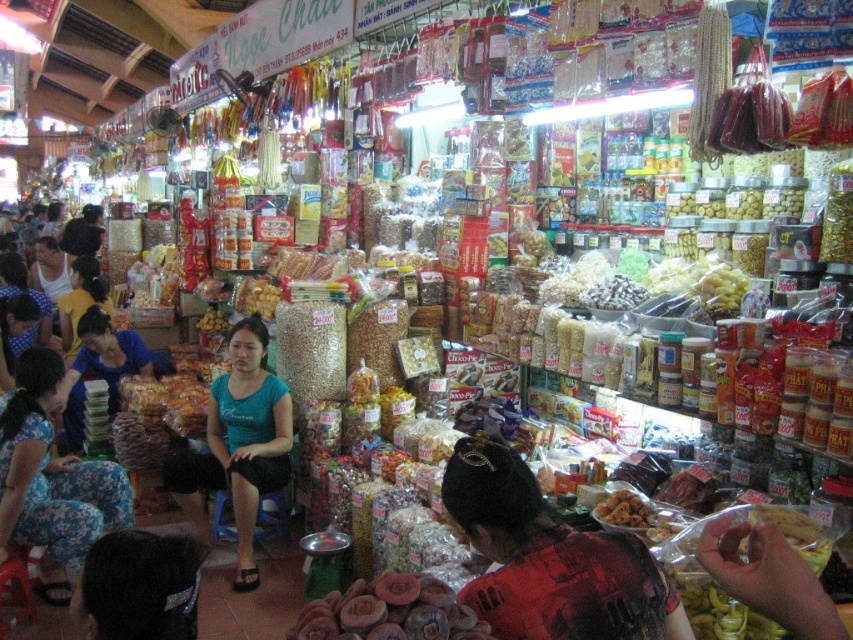
Question: Which of the following is the closest to the observer?

Choices:
 (A) blue fabric shirt at center
 (B) golden crispy snack at center
 (C) purple matte dried mushrooms at lower center
 (D) floral fabric pants at lower left

Answer: (C)

Question: Which of these objects is positioned farthest from the golden crispy snack at center?

Choices:
 (A) purple matte dried mushrooms at lower center
 (B) floral fabric pants at lower left
 (C) blue fabric shirt at center

Answer: (B)

Question: Is blue fabric shirt at center wider than golden crispy snack at center?

Choices:
 (A) no
 (B) yes

Answer: (B)

Question: Is purple matte dried mushrooms at lower center positioned behind golden crispy snack at center?

Choices:
 (A) no
 (B) yes

Answer: (A)

Question: Based on their relative distances, which object is farther from the purple matte dried mushrooms at lower center?

Choices:
 (A) golden crispy snack at center
 (B) floral fabric pants at lower left
 (C) blue fabric shirt at center

Answer: (C)

Question: Is blue fabric shirt at center smaller than golden crispy snack at center?

Choices:
 (A) no
 (B) yes

Answer: (A)